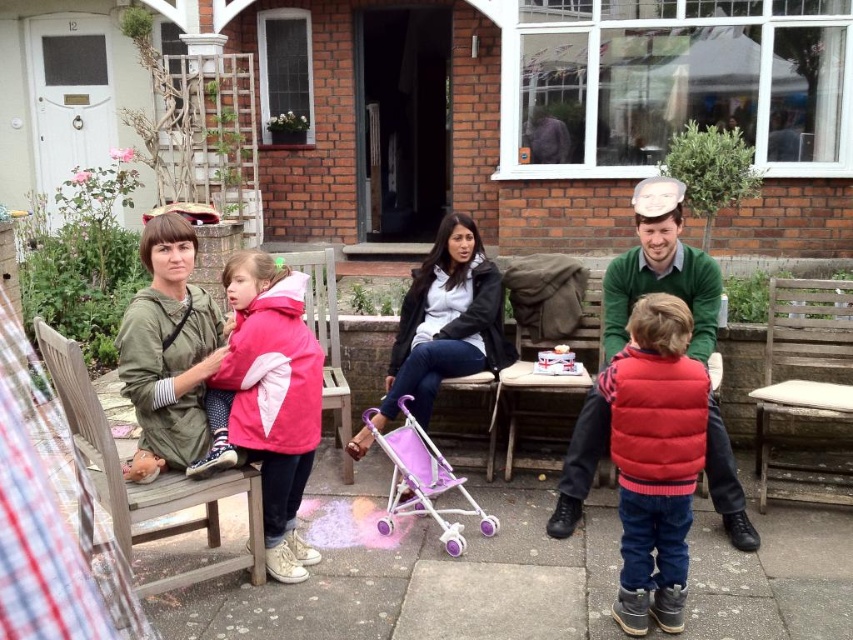
Which of these two, green sweater at center or weathered wood chair at right, stands taller?

green sweater at center

Who is positioned more to the right, green sweater at center or weathered wood chair at right?

weathered wood chair at right

Locate an element on the screen. The height and width of the screenshot is (640, 853). green sweater at center is located at coordinates (660, 269).

Is matte pink stroller at center positioned before pink fleece jacket at left?

Yes, matte pink stroller at center is in front of pink fleece jacket at left.

Does matte pink stroller at center have a greater width compared to pink fleece jacket at left?

Indeed, matte pink stroller at center has a greater width compared to pink fleece jacket at left.

You are a GUI agent. You are given a task and a screenshot of the screen. Output one action in this format:
    pyautogui.click(x=<x>, y=<y>)
    Task: Click on the matte pink stroller at center
    
    Given the screenshot: What is the action you would take?
    pyautogui.click(x=320, y=564)

Between green sweater at center and pink plastic stroller at center, which one appears on the left side from the viewer's perspective?

pink plastic stroller at center

Which is below, green sweater at center or pink plastic stroller at center?

pink plastic stroller at center

Is point (717, 326) farther from camera compared to point (425, 448)?

Yes, it is behind point (425, 448).

Locate an element on the screen. This screenshot has height=640, width=853. green sweater at center is located at coordinates (660, 269).